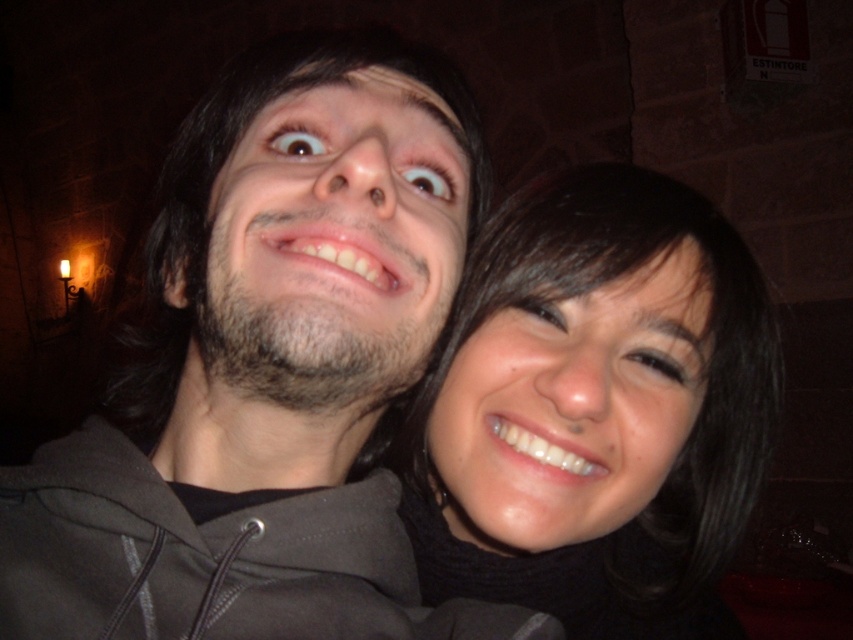
Question: Can you confirm if matte black hoodie at center is positioned to the left of smooth black hair at center?

Choices:
 (A) yes
 (B) no

Answer: (A)

Question: Is matte black hoodie at center bigger than smooth black hair at center?

Choices:
 (A) yes
 (B) no

Answer: (A)

Question: Which point is farther from the camera taking this photo?

Choices:
 (A) (418, 452)
 (B) (167, 220)

Answer: (A)

Question: Does matte black hoodie at center have a smaller size compared to smooth black hair at center?

Choices:
 (A) no
 (B) yes

Answer: (A)

Question: Among these objects, which one is nearest to the camera?

Choices:
 (A) matte black hoodie at center
 (B) smooth black hair at center

Answer: (A)